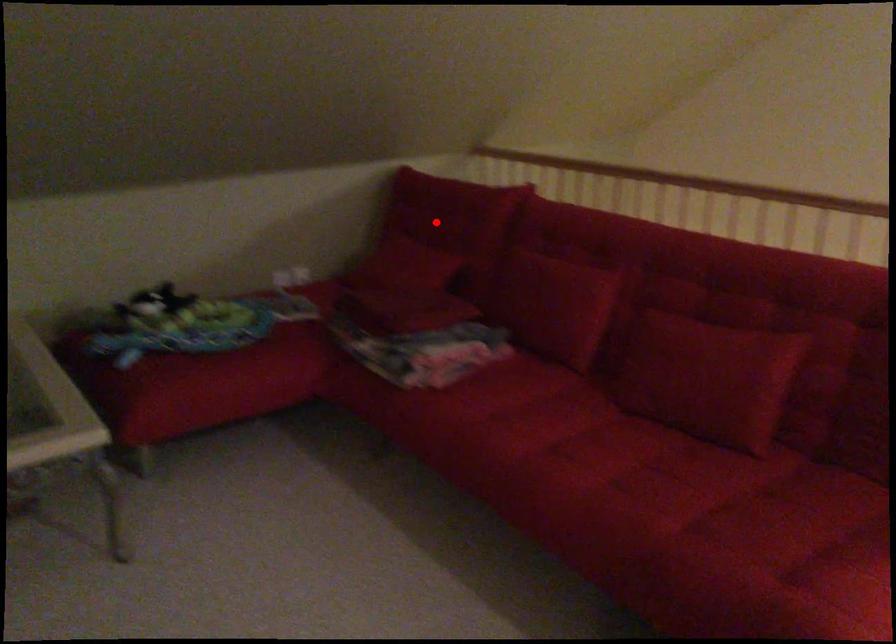
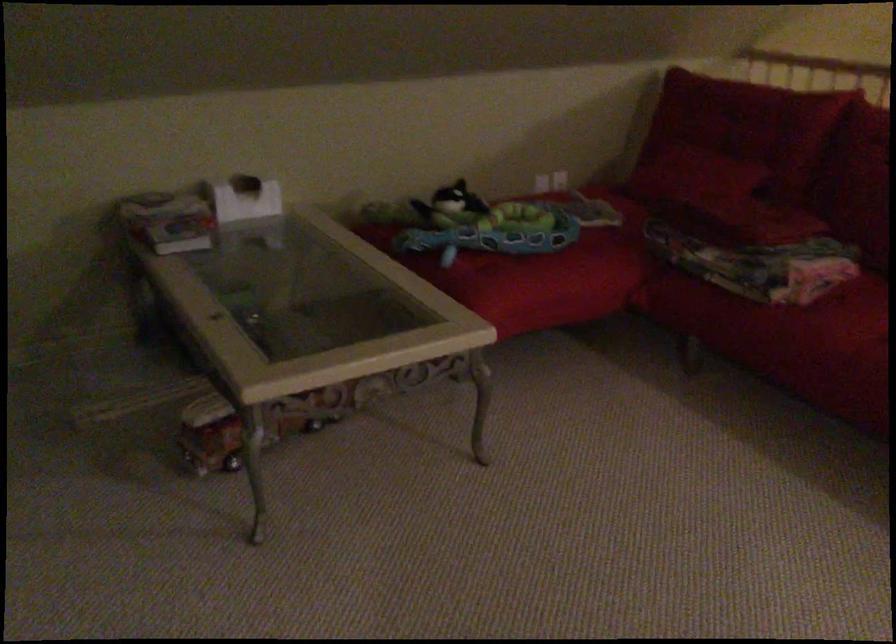
Find the pixel in the second image that matches the highlighted location in the first image.

(745, 125)